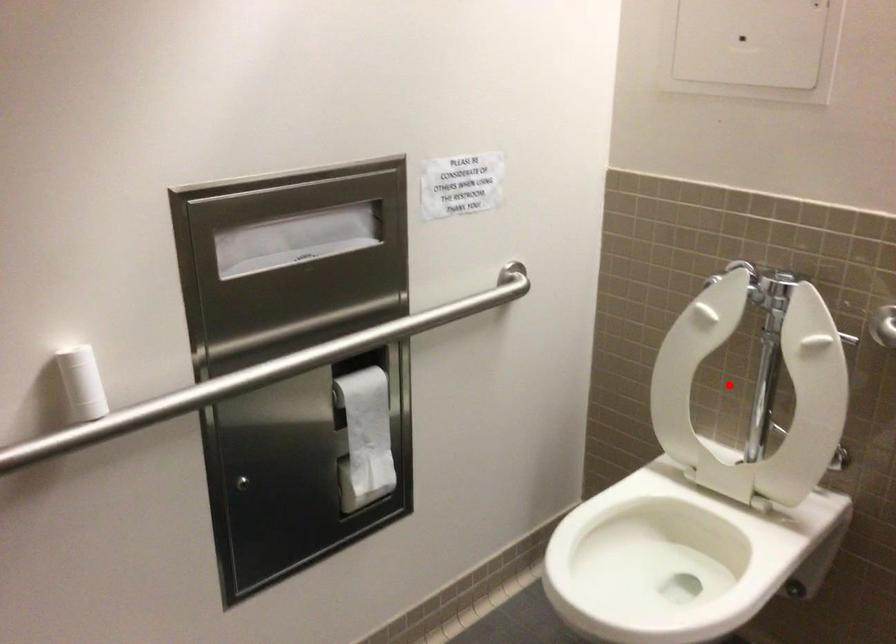
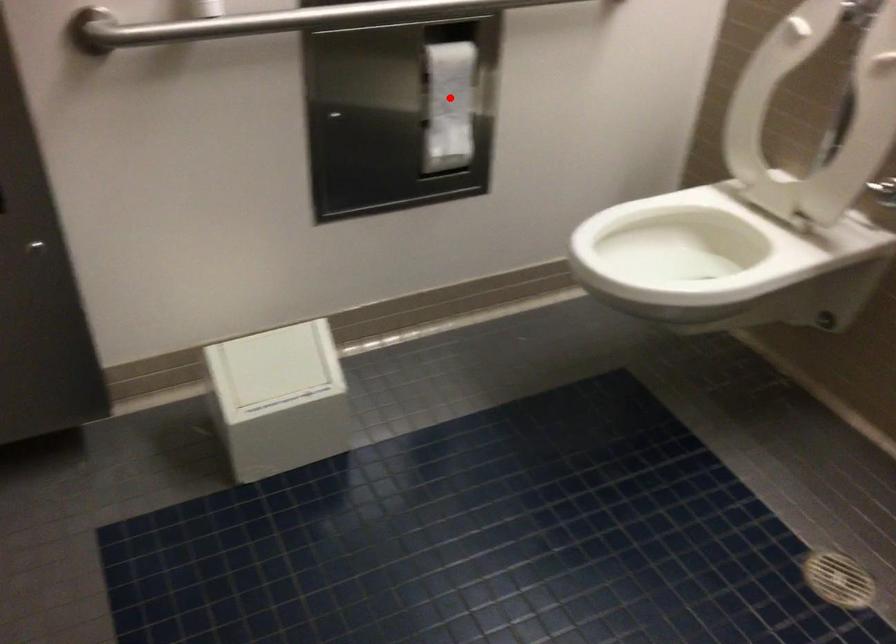
I am providing you with two images of the same scene from different viewpoints. A red point is marked on the first image and another point is marked on the second image. Does the point marked in image1 correspond to the same location as the one in image2?

No